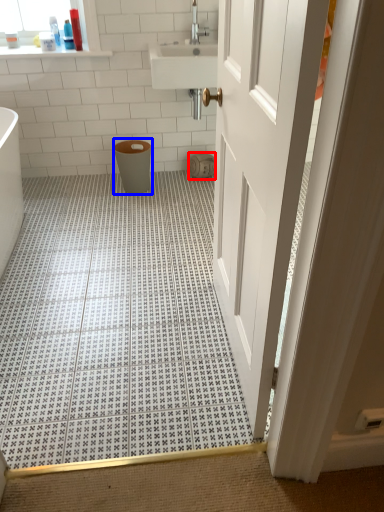
Question: Which object appears farthest to the camera in this image, toilet paper (highlighted by a red box) or toilet bowl (highlighted by a blue box)?

Choices:
 (A) toilet paper
 (B) toilet bowl

Answer: (A)